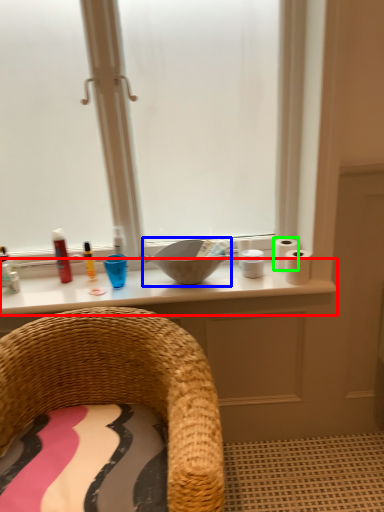
Question: Which object is positioned farthest from counter top (highlighted by a red box)? Select from sink (highlighted by a blue box) and toilet paper (highlighted by a green box).

Choices:
 (A) sink
 (B) toilet paper

Answer: (B)